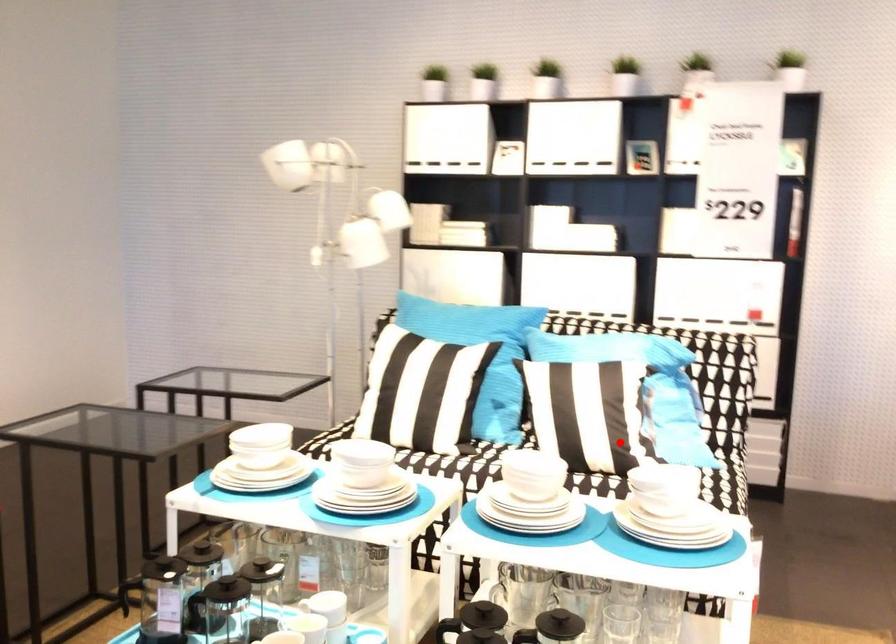
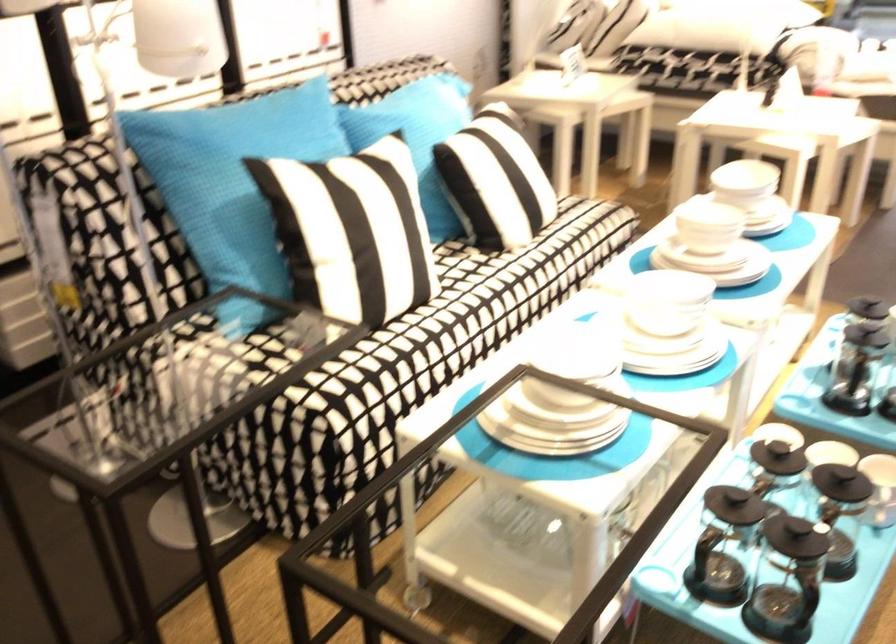
Question: I am providing you with two images of the same scene from different viewpoints. A red point is marked on the first image. Is the red point's position out of view in image 2?

Choices:
 (A) Yes
 (B) No

Answer: (A)